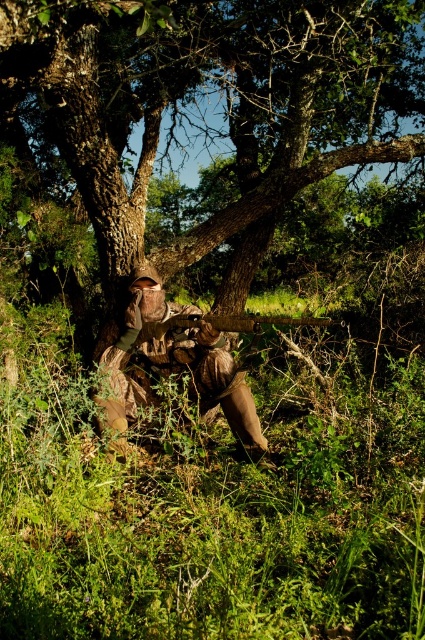
Question: Estimate the real-world distances between objects in this image. Which object is farther from the camouflage fabric rifle at center?

Choices:
 (A) wooden rifle at center
 (B) brown/camouflage tree at center

Answer: (B)

Question: Which object appears closest to the camera in this image?

Choices:
 (A) brown/camouflage tree at center
 (B) wooden rifle at center

Answer: (B)

Question: Is brown/camouflage tree at center wider than wooden rifle at center?

Choices:
 (A) yes
 (B) no

Answer: (A)

Question: Can you confirm if brown/camouflage tree at center is positioned above wooden rifle at center?

Choices:
 (A) yes
 (B) no

Answer: (A)

Question: Is brown/camouflage tree at center positioned behind camouflage fabric rifle at center?

Choices:
 (A) yes
 (B) no

Answer: (A)

Question: Which object appears closest to the camera in this image?

Choices:
 (A) wooden rifle at center
 (B) brown/camouflage tree at center
 (C) camouflage fabric rifle at center

Answer: (A)